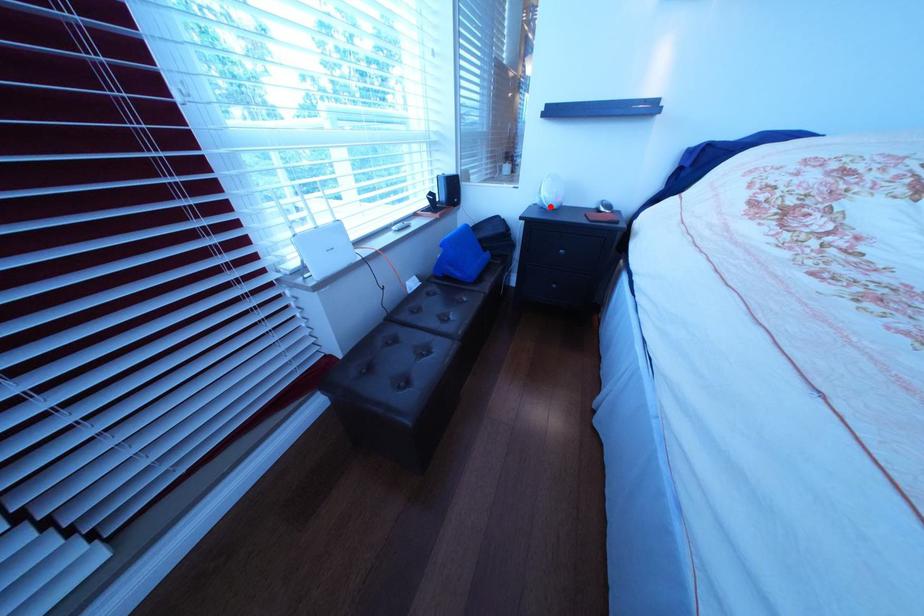
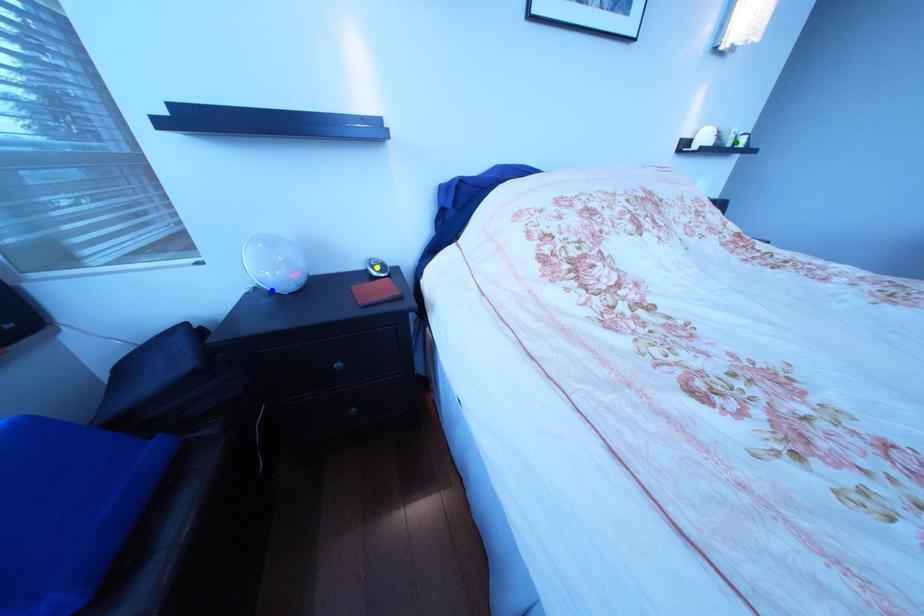
Question: I am providing you with two images of the same scene from different viewpoints. A red point is marked on the first image. You are given multiple points on the second image. Which point in image 2 is actually the same real-world point as the red point in image 1?

Choices:
 (A) green point
 (B) blue point
 (C) yellow point

Answer: (B)